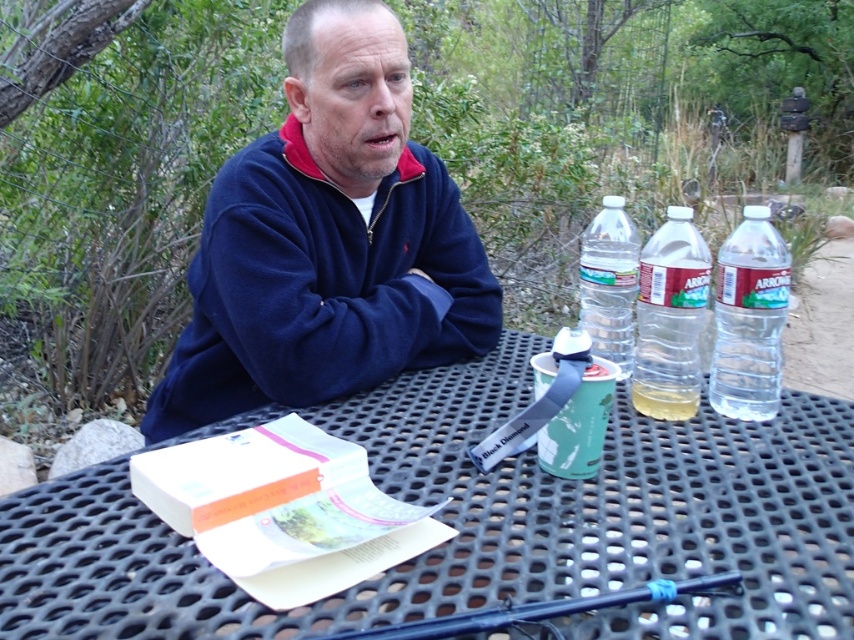
Is point (729, 337) closer to viewer compared to point (679, 419)?

No, it is not.

You are a GUI agent. You are given a task and a screenshot of the screen. Output one action in this format:
    pyautogui.click(x=<x>, y=<y>)
    Task: Click on the clear plastic bottle at right
    The width and height of the screenshot is (854, 640).
    Given the screenshot: What is the action you would take?
    pyautogui.click(x=749, y=317)

In order to click on clear plastic bottle at right in this screenshot , I will do `click(749, 317)`.

Who is more distant from viewer, (627, 621) or (676, 396)?

The point (676, 396) is behind.

Is point (598, 584) in front of point (661, 410)?

That is True.

Between point (338, 620) and point (650, 387), which one is positioned in front?

Positioned in front is point (338, 620).

Where is `black metal table at center`? Image resolution: width=854 pixels, height=640 pixels. black metal table at center is located at coordinates (484, 524).

Who is lower down, black metal table at center or navy blue fleece at center?

black metal table at center is lower down.

Who is more distant from viewer, (57, 536) or (390, 250)?

The point (390, 250) is more distant.

This screenshot has height=640, width=854. What are the coordinates of `black metal table at center` in the screenshot? It's located at (484, 524).

Where is `black metal table at center`? This screenshot has height=640, width=854. black metal table at center is located at coordinates (484, 524).